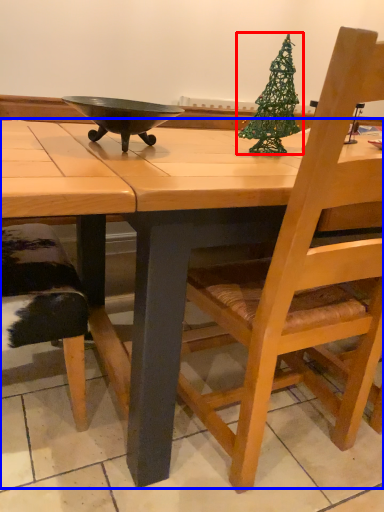
Question: Which of the following is the farthest to the observer, christmas tree (highlighted by a red box) or desk (highlighted by a blue box)?

Choices:
 (A) christmas tree
 (B) desk

Answer: (A)